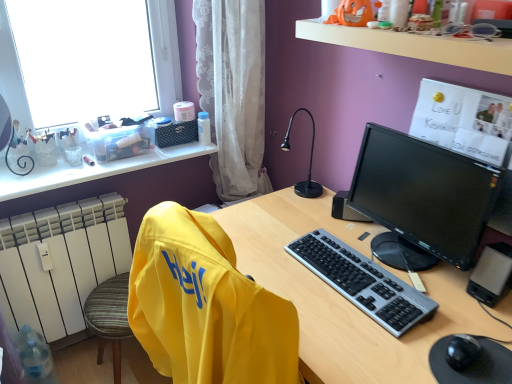
Locate an element on the screen. free spot in front of black glossy monitor at center right is located at coordinates (422, 324).